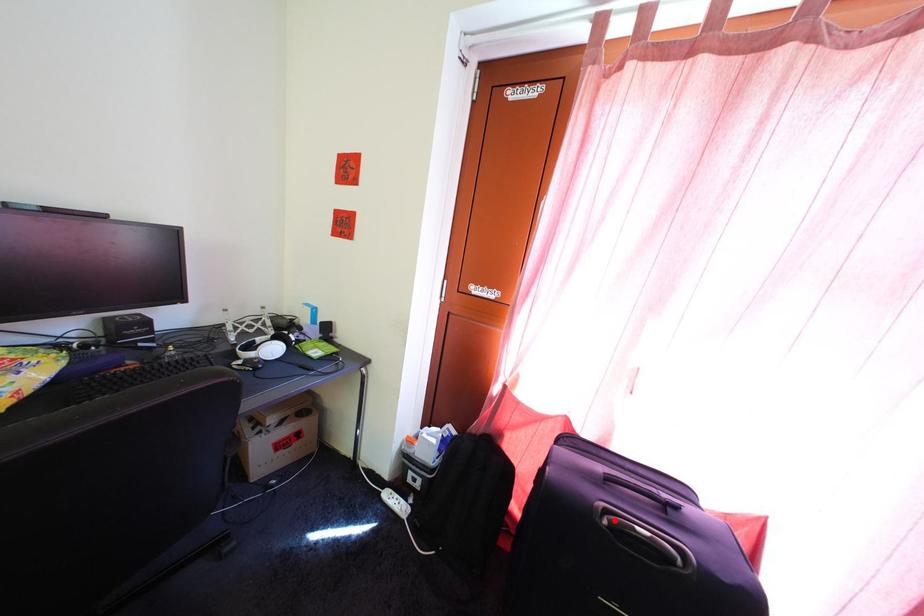
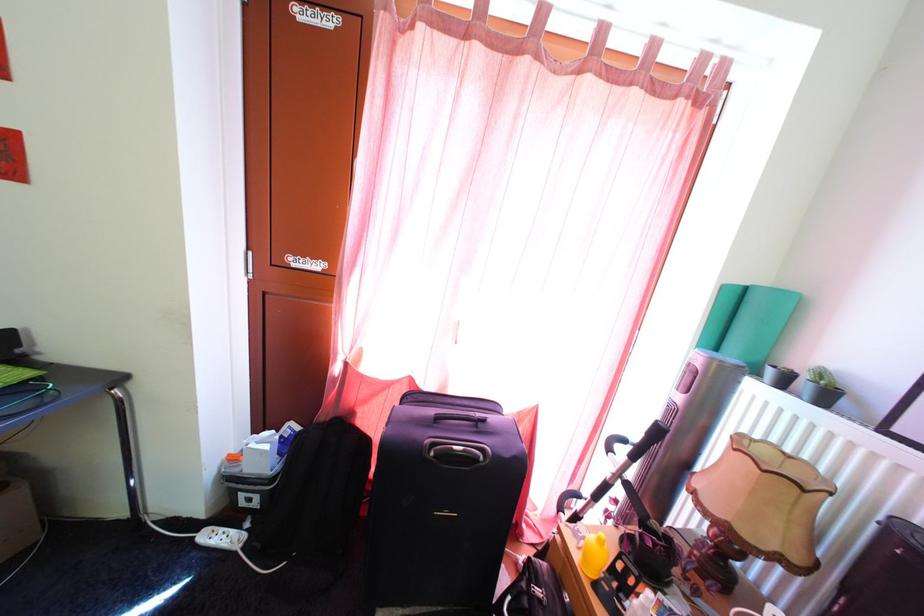
The point at the highlighted location is marked in the first image. Where is the corresponding point in the second image?

(441, 454)